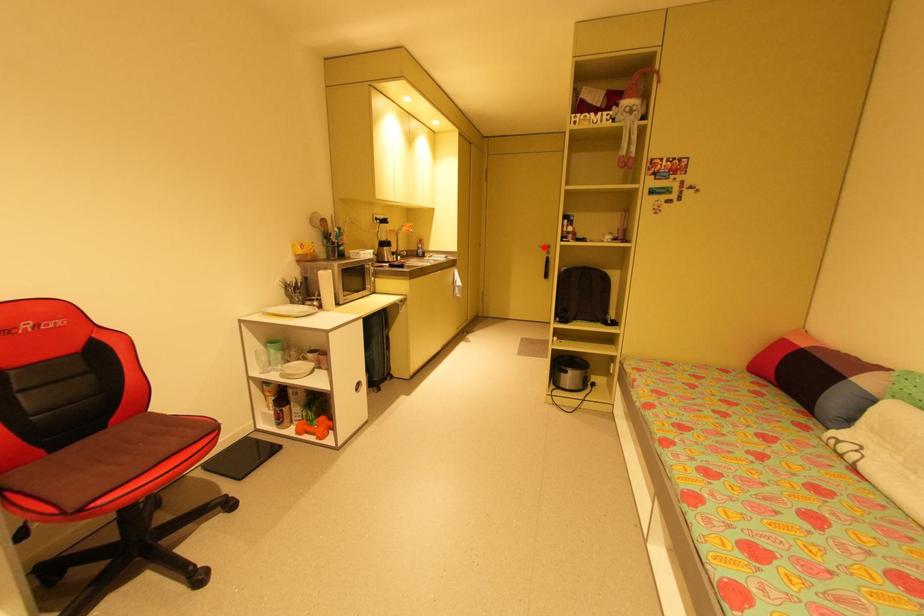
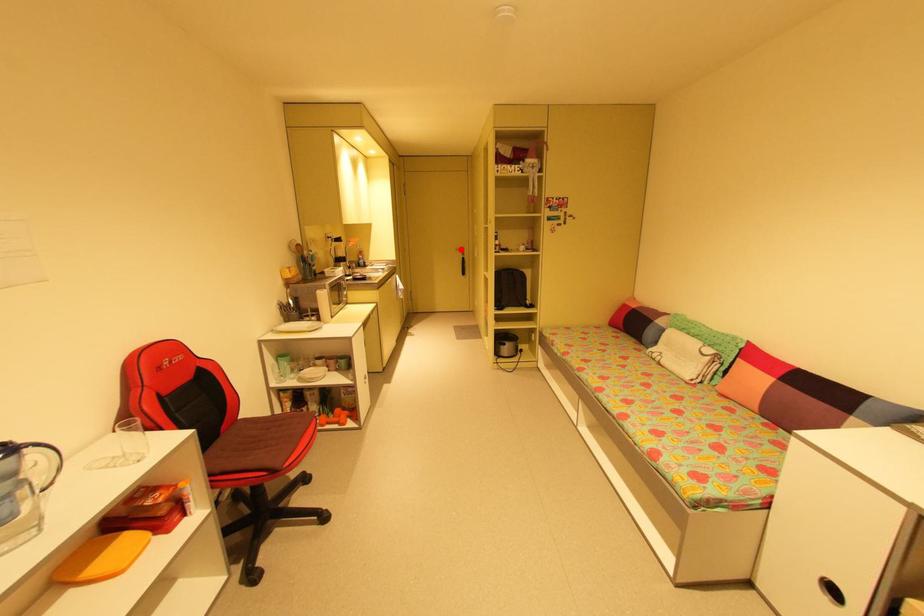
I am providing you with two images of the same scene from different viewpoints. A red point is marked on the first image and another point is marked on the second image. Is the red point in image1 aligned with the point shown in image2?

Yes